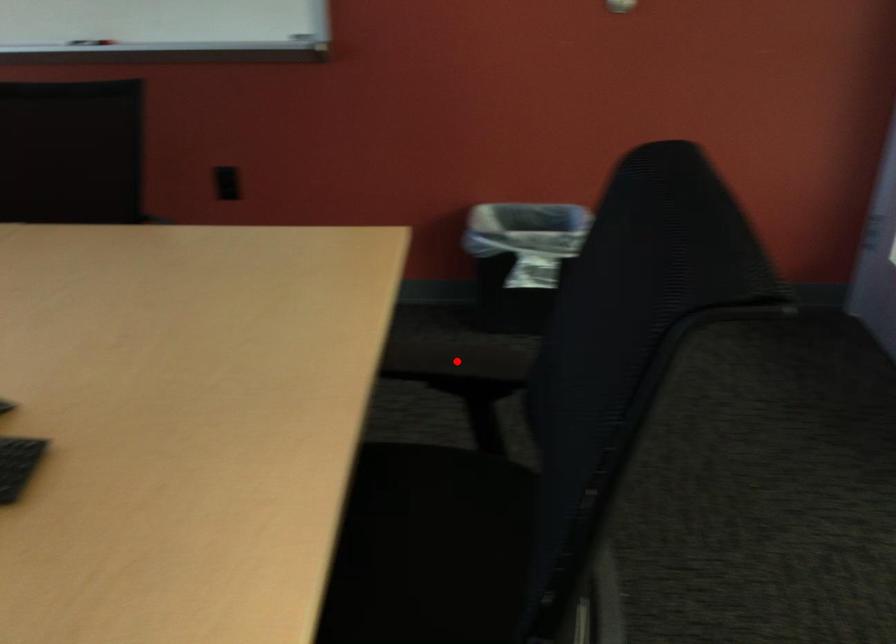
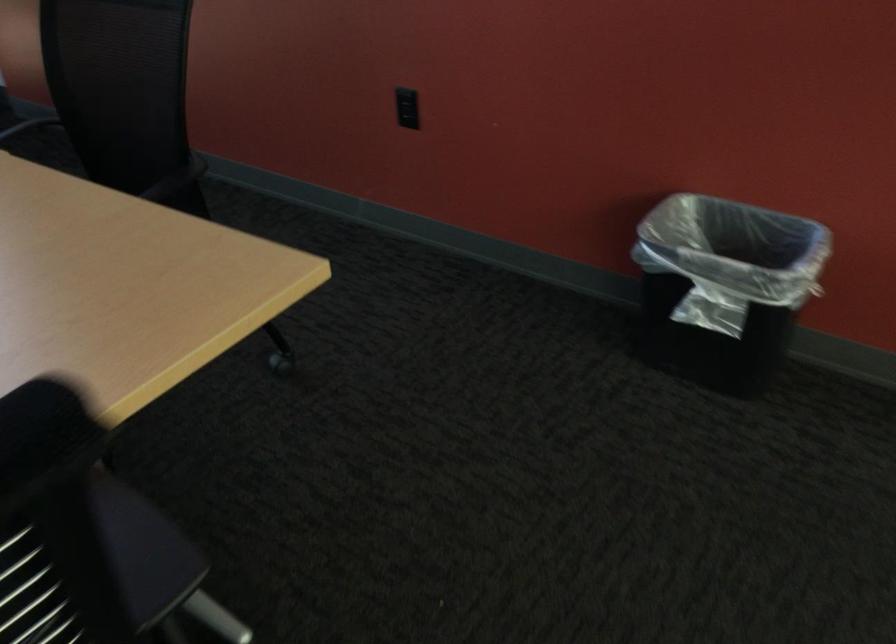
Question: I am providing you with two images of the same scene from different viewpoints. A red point is marked on the first image. Is the red point's position out of view in image 2?

Choices:
 (A) Yes
 (B) No

Answer: (A)